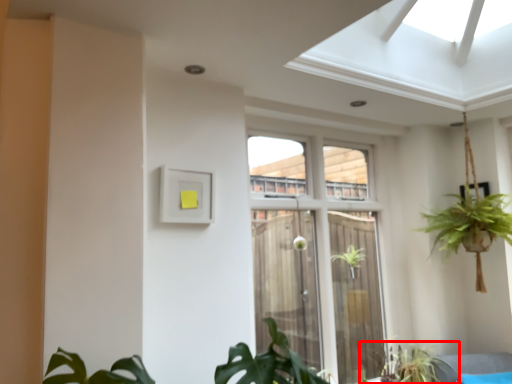
Question: From the image, what is the correct spatial relationship of houseplant (annotated by the red box) in relation to window?

Choices:
 (A) right
 (B) left

Answer: (A)